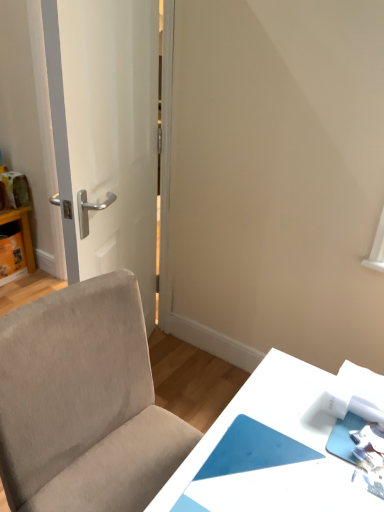
Based on the photo, what is the approximate width of white glossy table at lower right, which is the 2th table in left-to-right order?

15.39 inches.

The width and height of the screenshot is (384, 512). I want to click on white glossy table at lower right, which is the 2th table in top-to-bottom order, so click(x=275, y=430).

Measure the distance between point [23,231] and camera.

Point [23,231] and camera are 8.80 feet apart from each other.

The width and height of the screenshot is (384, 512). Identify the location of beige fabric chair at lower left. (84, 403).

Locate an element on the screen. This screenshot has width=384, height=512. table that appears in front of the matte cardboard box at left, which appears as the first table when viewed from the back is located at coordinates (275, 430).

Is matte cardboard box at left, which ranks as the second table in front-to-back order, oriented towards white glossy table at lower right, which is counted as the 1th table, starting from the front?

Yes, matte cardboard box at left, which ranks as the second table in front-to-back order, faces towards white glossy table at lower right, which is counted as the 1th table, starting from the front.

Which object is further away from the camera taking this photo, matte cardboard box at left, which is the second table from right to left, or white glossy table at lower right, placed as the first table when sorted from bottom to top?

Positioned behind is matte cardboard box at left, which is the second table from right to left.

From the image's perspective, which is below, matte cardboard box at left, which ranks as the second table in front-to-back order, or white glossy table at lower right, which is the 2th table in top-to-bottom order?

white glossy table at lower right, which is the 2th table in top-to-bottom order, from the image's perspective.

From a real-world perspective, does beige fabric chair at lower left sit lower than matte cardboard box at left, the first table positioned from the top?

Incorrect, from a real-world perspective, beige fabric chair at lower left is higher than matte cardboard box at left, the first table positioned from the top.

Is beige fabric chair at lower left looking in the opposite direction of matte cardboard box at left, which ranks as the second table in front-to-back order?

Absolutely, beige fabric chair at lower left is directed away from matte cardboard box at left, which ranks as the second table in front-to-back order.

Between beige fabric chair at lower left and matte cardboard box at left, which is the second table from right to left, which one has less height?

matte cardboard box at left, which is the second table from right to left.

Is point (24, 323) closer to viewer compared to point (26, 214)?

Yes.

Looking at this image, from a real-world perspective, does matte cardboard box at left, which appears as the first table when viewed from the back, sit lower than white glossy door at left?

Yes.

Can you confirm if matte cardboard box at left, which is the second table from right to left, is smaller than white glossy door at left?

Correct, matte cardboard box at left, which is the second table from right to left, occupies less space than white glossy door at left.

Are matte cardboard box at left, the first table positioned from the top, and white glossy door at left far apart?

Yes, matte cardboard box at left, the first table positioned from the top, and white glossy door at left are quite far apart.

Is matte cardboard box at left, the first table positioned from the top, positioned with its back to white glossy door at left?

That's not correct — matte cardboard box at left, the first table positioned from the top, is not looking away from white glossy door at left.

Are white glossy door at left and beige fabric chair at lower left beside each other?

There is a gap between white glossy door at left and beige fabric chair at lower left.

What's the angular difference between white glossy door at left and beige fabric chair at lower left's facing directions?

white glossy door at left and beige fabric chair at lower left are facing 153 degrees away from each other.

Considering the sizes of objects white glossy door at left and beige fabric chair at lower left in the image provided, who is taller, white glossy door at left or beige fabric chair at lower left?

Standing taller between the two is white glossy door at left.

Which object is positioned more to the left, matte cardboard box at left, which appears as the first table when viewed from the back, or beige fabric chair at lower left?

From the viewer's perspective, matte cardboard box at left, which appears as the first table when viewed from the back, appears more on the left side.

Is matte cardboard box at left, which ranks as the second table in front-to-back order, far away from beige fabric chair at lower left?

Yes, matte cardboard box at left, which ranks as the second table in front-to-back order, is far from beige fabric chair at lower left.

Which is behind, matte cardboard box at left, which ranks as the second table in front-to-back order, or beige fabric chair at lower left?

matte cardboard box at left, which ranks as the second table in front-to-back order, is behind.

From the picture: Is matte cardboard box at left, the first table positioned from the top, facing away from beige fabric chair at lower left?

No, matte cardboard box at left, the first table positioned from the top,'s orientation is not away from beige fabric chair at lower left.

Is white glossy door at left oriented away from white glossy table at lower right, acting as the first table starting from the right?

No.

Which object is further away from the camera, white glossy door at left or white glossy table at lower right, which is counted as the 2th table, starting from the back?

Positioned behind is white glossy door at left.

From a real-world perspective, who is located lower, white glossy door at left or white glossy table at lower right, which is counted as the 1th table, starting from the front?

white glossy table at lower right, which is counted as the 1th table, starting from the front.

Find the location of a particular element. This screenshot has height=512, width=384. table in front of the white glossy door at left is located at coordinates (275, 430).

Considering their positions, is beige fabric chair at lower left located in front of or behind white glossy table at lower right, placed as the first table when sorted from bottom to top?

Clearly, beige fabric chair at lower left is in front of white glossy table at lower right, placed as the first table when sorted from bottom to top.

Is point (134, 424) in front of point (212, 426)?

No, (134, 424) is behind (212, 426).

Considering the relative sizes of beige fabric chair at lower left and white glossy table at lower right, which is counted as the 1th table, starting from the front, in the image provided, is beige fabric chair at lower left smaller than white glossy table at lower right, which is counted as the 1th table, starting from the front,?

Actually, beige fabric chair at lower left might be larger than white glossy table at lower right, which is counted as the 1th table, starting from the front.

Between beige fabric chair at lower left and white glossy table at lower right, which is the 2th table in left-to-right order, which one has larger width?

beige fabric chair at lower left is wider.

Locate an element on the screen. This screenshot has height=512, width=384. table located on the left of white glossy table at lower right, which is the 2th table in left-to-right order is located at coordinates (22, 232).

The image size is (384, 512). Find the location of `the 2nd table below the beige fabric chair at lower left (from a real-world perspective)`. the 2nd table below the beige fabric chair at lower left (from a real-world perspective) is located at coordinates (22, 232).

Based on their spatial positions, is white glossy door at left or matte cardboard box at left, the 2th table from the bottom, further from beige fabric chair at lower left?

Among the two, matte cardboard box at left, the 2th table from the bottom, is located further to beige fabric chair at lower left.

Considering their positions, is matte cardboard box at left, the first table in the left-to-right sequence, positioned closer to white glossy table at lower right, placed as the first table when sorted from bottom to top, than beige fabric chair at lower left?

Among the two, beige fabric chair at lower left is located nearer to white glossy table at lower right, placed as the first table when sorted from bottom to top.

Which object lies further to the anchor point white glossy table at lower right, which is counted as the 2th table, starting from the back, white glossy door at left or beige fabric chair at lower left?

Based on the image, white glossy door at left appears to be further to white glossy table at lower right, which is counted as the 2th table, starting from the back.

Considering their positions, is matte cardboard box at left, which appears as the first table when viewed from the back, positioned closer to beige fabric chair at lower left than white glossy table at lower right, which is counted as the 1th table, starting from the front?

The object closer to beige fabric chair at lower left is white glossy table at lower right, which is counted as the 1th table, starting from the front.

From the picture: Considering their positions, is white glossy door at left positioned closer to beige fabric chair at lower left than white glossy table at lower right, acting as the first table starting from the right?

white glossy table at lower right, acting as the first table starting from the right, lies closer to beige fabric chair at lower left than the other object.

Which object lies nearer to the anchor point white glossy door at left, white glossy table at lower right, which is the 2th table in left-to-right order, or beige fabric chair at lower left?

Among the two, beige fabric chair at lower left is located nearer to white glossy door at left.

Looking at the image, which one is located further to white glossy door at left, matte cardboard box at left, which is the second table from right to left, or beige fabric chair at lower left?

Based on the image, matte cardboard box at left, which is the second table from right to left, appears to be further to white glossy door at left.

When comparing their distances from matte cardboard box at left, which ranks as the second table in front-to-back order, does beige fabric chair at lower left or white glossy table at lower right, which is counted as the 2th table, starting from the back, seem closer?

beige fabric chair at lower left.

Where is `door located between white glossy table at lower right, acting as the first table starting from the right, and matte cardboard box at left, the first table in the left-to-right sequence, in the depth direction`? door located between white glossy table at lower right, acting as the first table starting from the right, and matte cardboard box at left, the first table in the left-to-right sequence, in the depth direction is located at coordinates pos(106,132).

Identify the location of door between beige fabric chair at lower left and matte cardboard box at left, which appears as the first table when viewed from the back, in the front-back direction. This screenshot has width=384, height=512. (106, 132).

Locate an element on the screen. The height and width of the screenshot is (512, 384). table located between beige fabric chair at lower left and matte cardboard box at left, which ranks as the second table in front-to-back order, in the depth direction is located at coordinates coord(275,430).

This screenshot has height=512, width=384. What are the coordinates of `chair between white glossy door at left and white glossy table at lower right, which is counted as the 2th table, starting from the back, in the vertical direction` in the screenshot? It's located at (84, 403).